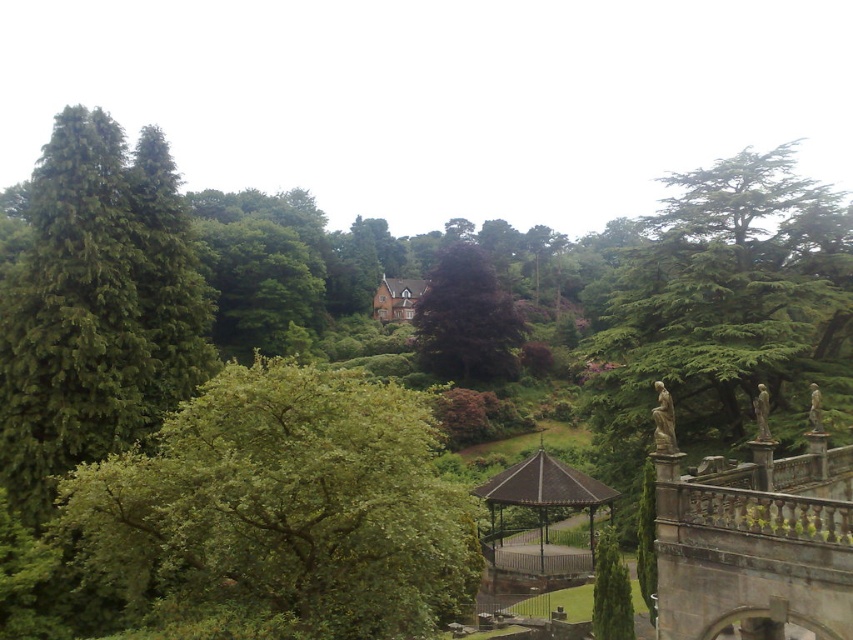
Is green leafy tree at center smaller than metallic gazebo at center?

Actually, green leafy tree at center might be larger than metallic gazebo at center.

Does point (408, 600) come in front of point (589, 506)?

Yes, point (408, 600) is in front of point (589, 506).

Where is `green leafy tree at center`? The width and height of the screenshot is (853, 640). green leafy tree at center is located at coordinates (282, 508).

Can you confirm if green leafy tree at center is bigger than dark purple leafy tree at center?

Incorrect, green leafy tree at center is not larger than dark purple leafy tree at center.

Who is positioned more to the right, green leafy tree at center or dark purple leafy tree at center?

Positioned to the right is dark purple leafy tree at center.

Is point (267, 547) less distant than point (447, 292)?

Yes, point (267, 547) is in front of point (447, 292).

At what (x,y) coordinates should I click in order to perform the action: click on green leafy tree at center. Please return your answer as a coordinate pair (x, y). Image resolution: width=853 pixels, height=640 pixels. Looking at the image, I should click on (282, 508).

Is dark purple leafy tree at center further to camera compared to metallic gazebo at center?

Yes, dark purple leafy tree at center is further from the viewer.

Does point (485, 301) come closer to viewer compared to point (546, 484)?

No, it is not.

What are the coordinates of `dark purple leafy tree at center` in the screenshot? It's located at (466, 321).